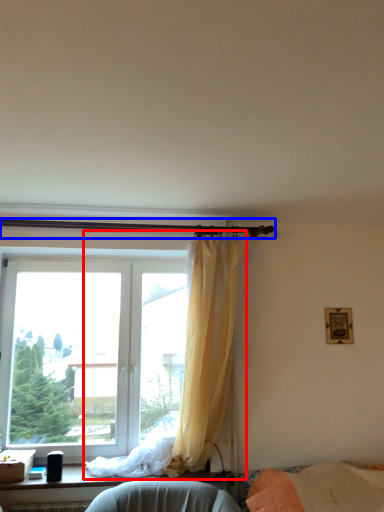
Question: Among these objects, which one is farthest to the camera, curtain (highlighted by a red box) or beam (highlighted by a blue box)?

Choices:
 (A) curtain
 (B) beam

Answer: (B)